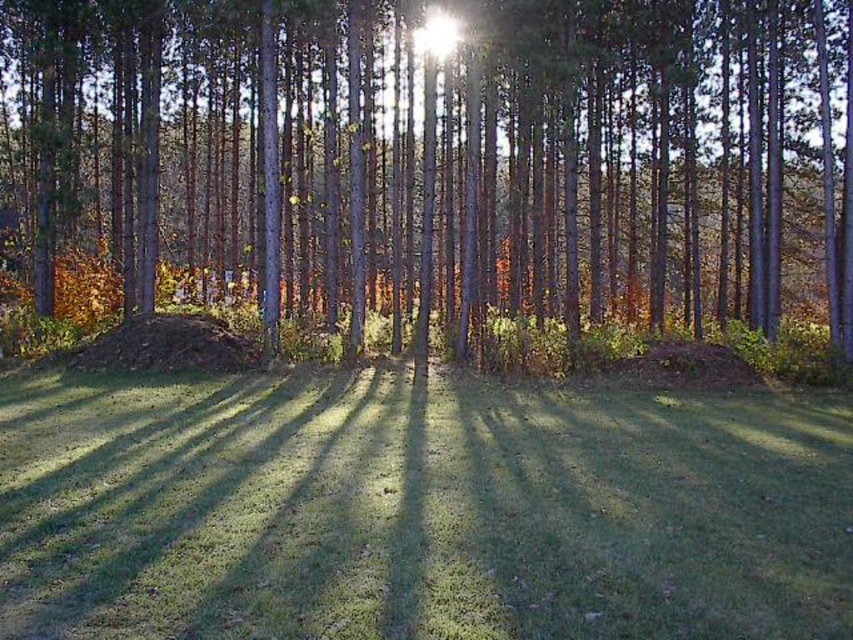
Can you confirm if green matte tree at center is positioned to the right of green grass at center?

Yes, green matte tree at center is to the right of green grass at center.

Is point (804, 116) closer to camera compared to point (640, 436)?

No, (804, 116) is further to viewer.

The height and width of the screenshot is (640, 853). I want to click on green matte tree at center, so click(x=434, y=163).

Is the position of green grass at center more distant than that of brown/dry leaves at center?

No, it is in front of brown/dry leaves at center.

This screenshot has height=640, width=853. What do you see at coordinates (418, 509) in the screenshot? I see `green grass at center` at bounding box center [418, 509].

Is point (605, 502) in front of point (225, 342)?

Yes, point (605, 502) is in front of point (225, 342).

You are a GUI agent. You are given a task and a screenshot of the screen. Output one action in this format:
    pyautogui.click(x=<x>, y=<y>)
    Task: Click on the green grass at center
    The image size is (853, 640).
    Given the screenshot: What is the action you would take?
    pyautogui.click(x=418, y=509)

Is green matte tree at center above brown/dry leaves at center?

Yes, green matte tree at center is above brown/dry leaves at center.

Is green matte tree at center closer to camera compared to brown/dry leaves at center?

That is False.

At what (x,y) coordinates should I click in order to perform the action: click on green matte tree at center. Please return your answer as a coordinate pair (x, y). This screenshot has height=640, width=853. Looking at the image, I should click on (434, 163).

I want to click on green matte tree at center, so click(434, 163).